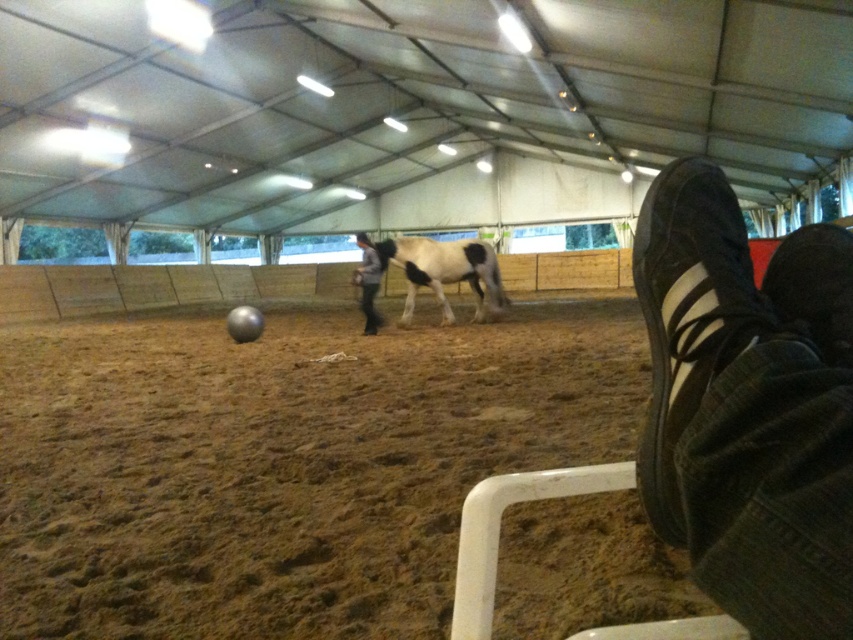
Can you confirm if black suede shoe at lower right is positioned above light gray fabric pants at center?

Actually, black suede shoe at lower right is below light gray fabric pants at center.

Between point (680, 403) and point (366, 257), which one is positioned in front?

Positioned in front is point (680, 403).

You are a GUI agent. You are given a task and a screenshot of the screen. Output one action in this format:
    pyautogui.click(x=<x>, y=<y>)
    Task: Click on the black suede shoe at lower right
    This screenshot has height=640, width=853.
    Given the screenshot: What is the action you would take?
    pyautogui.click(x=688, y=314)

Who is taller, black suede shoe at lower right or white and black speckled horse at center?

With more height is white and black speckled horse at center.

Based on the photo, does black suede shoe at lower right come in front of white and black speckled horse at center?

Yes, it is in front of white and black speckled horse at center.

Between point (703, 220) and point (404, 317), which one is positioned in front?

Positioned in front is point (703, 220).

Locate an element on the screen. This screenshot has height=640, width=853. black suede shoe at lower right is located at coordinates (688, 314).

Identify the location of white and black speckled horse at center. The width and height of the screenshot is (853, 640). (445, 269).

Consider the image. Who is shorter, white and black speckled horse at center or light gray fabric pants at center?

With less height is white and black speckled horse at center.

Where is `white and black speckled horse at center`? white and black speckled horse at center is located at coordinates (445, 269).

Identify the location of white and black speckled horse at center. The height and width of the screenshot is (640, 853). pyautogui.click(x=445, y=269).